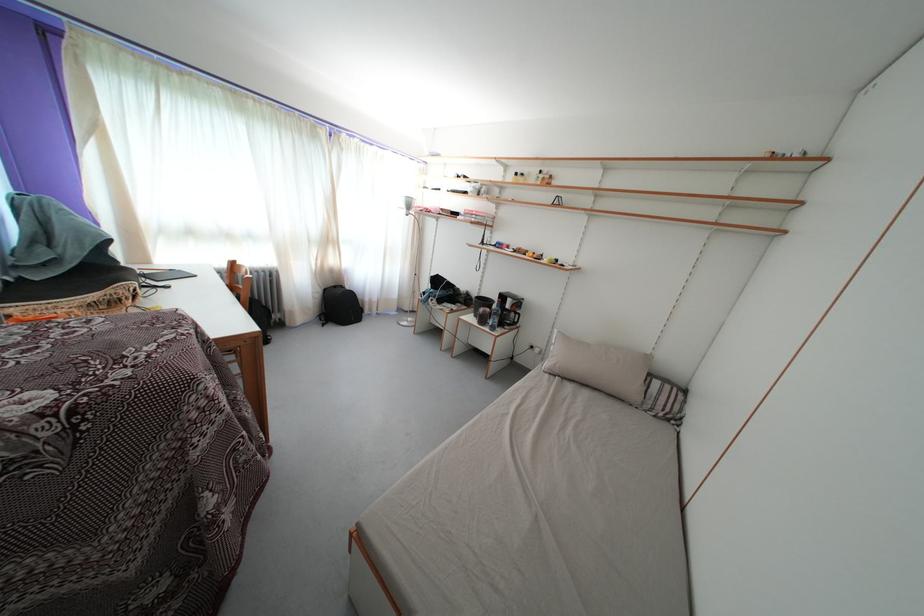
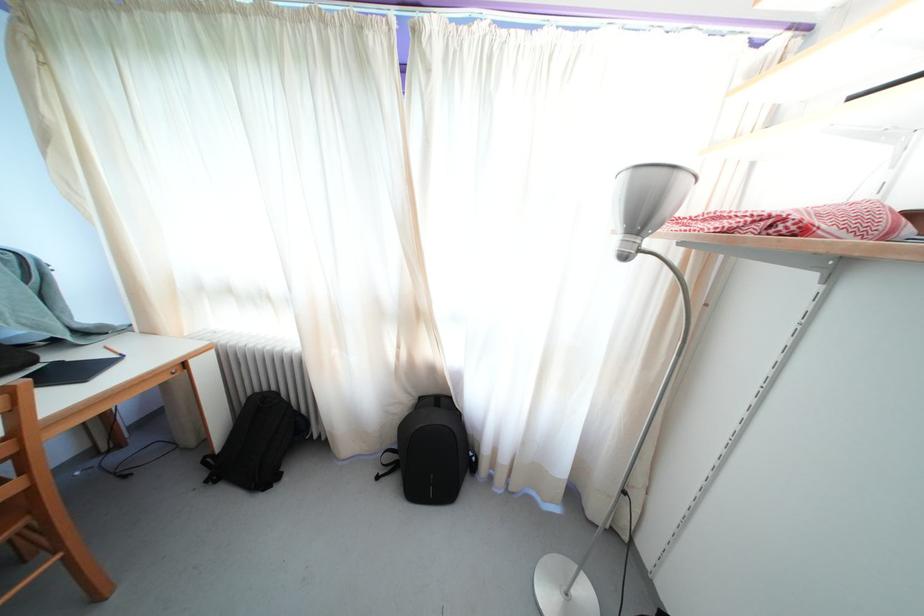
The point at (415,213) is marked in the first image. Where is the corresponding point in the second image?

(648, 223)